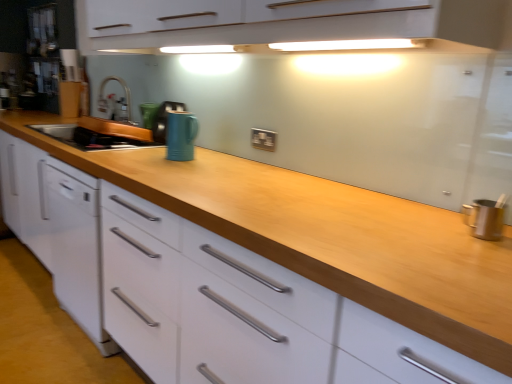
Identify the location of free space in front of metallic silver utensil holder at right. This screenshot has width=512, height=384. (485, 250).